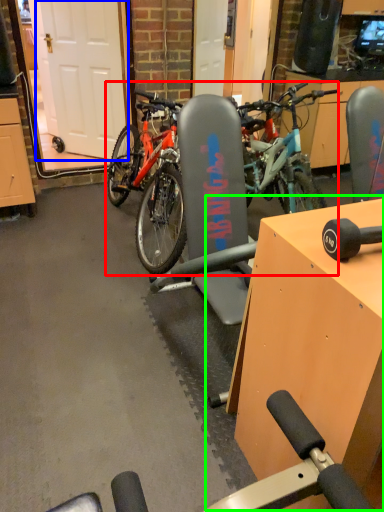
Question: Which object is the farthest from bicycle (highlighted by a red box)? Choose among these: garage door (highlighted by a blue box) or table (highlighted by a green box).

Choices:
 (A) garage door
 (B) table

Answer: (B)